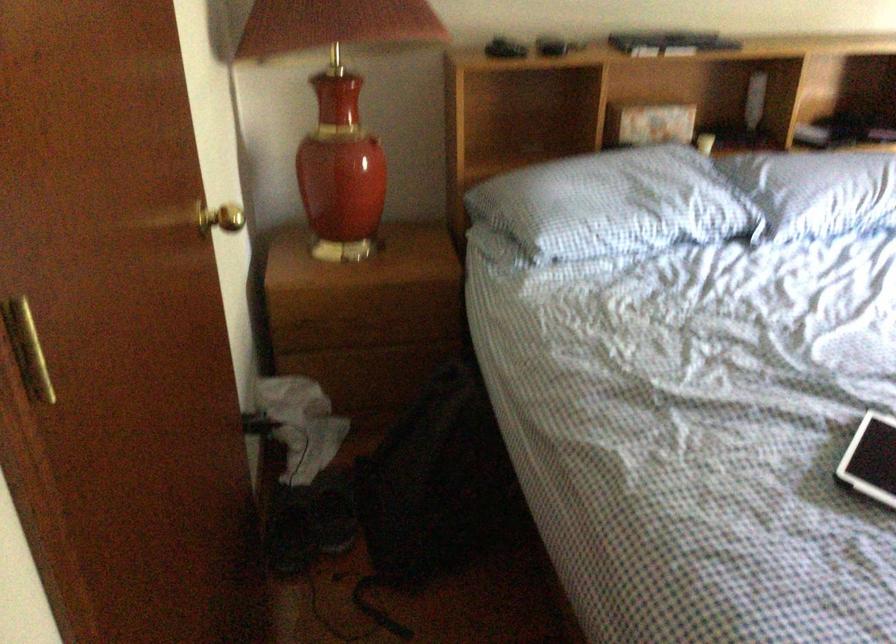
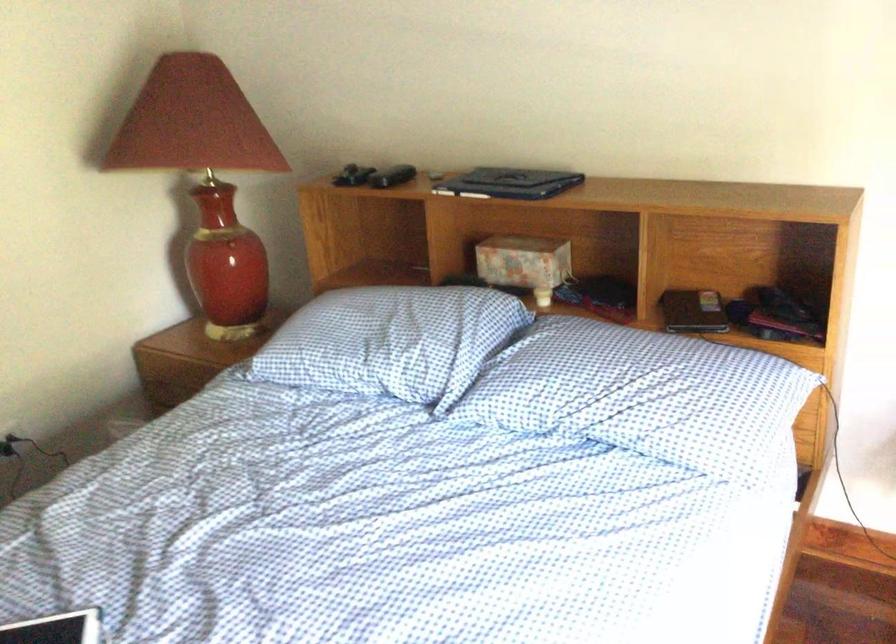
Locate, in the second image, the point that corresponds to (683,115) in the first image.

(524, 263)